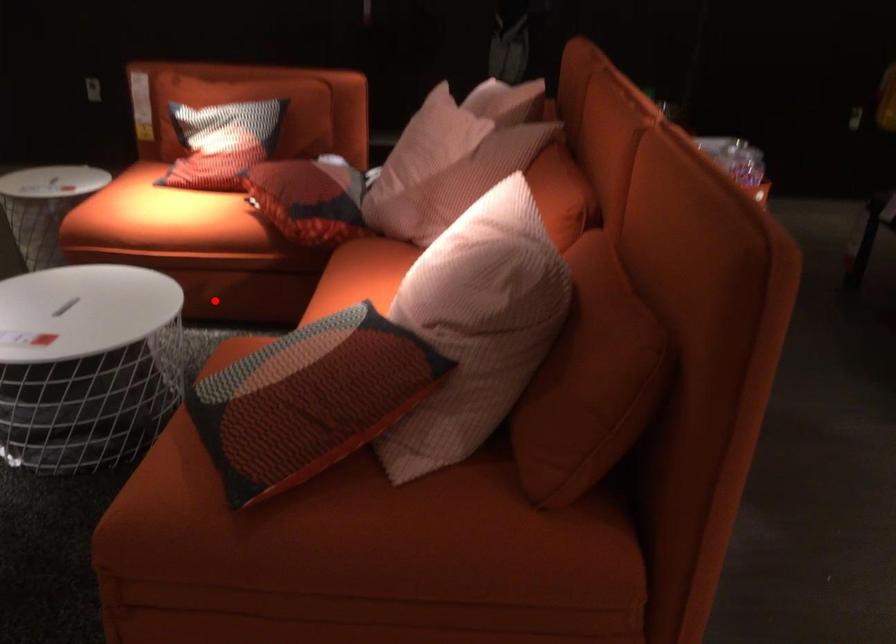
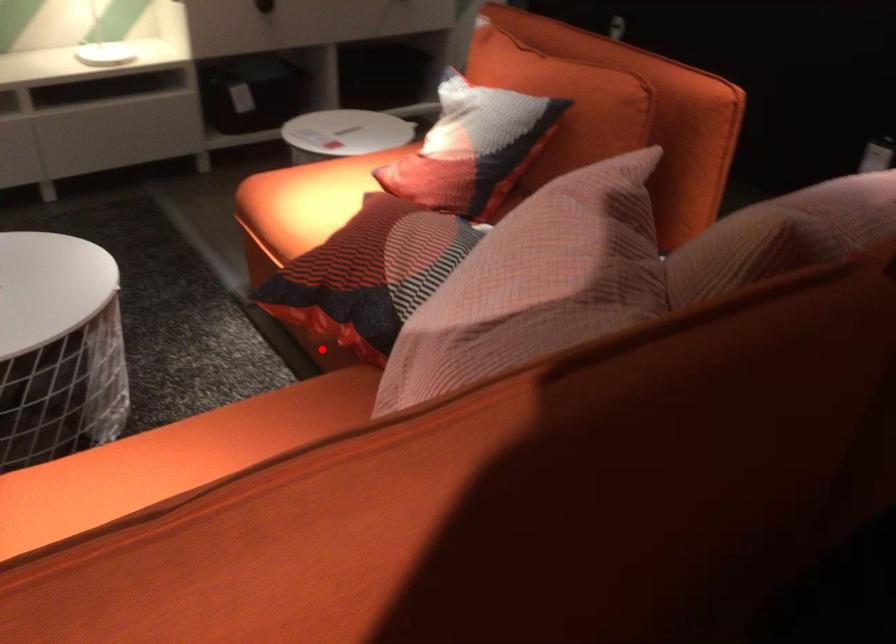
I am providing you with two images of the same scene from different viewpoints. A red point is marked on the first image and another point is marked on the second image. Is the marked point in image1 the same physical position as the marked point in image2?

Yes